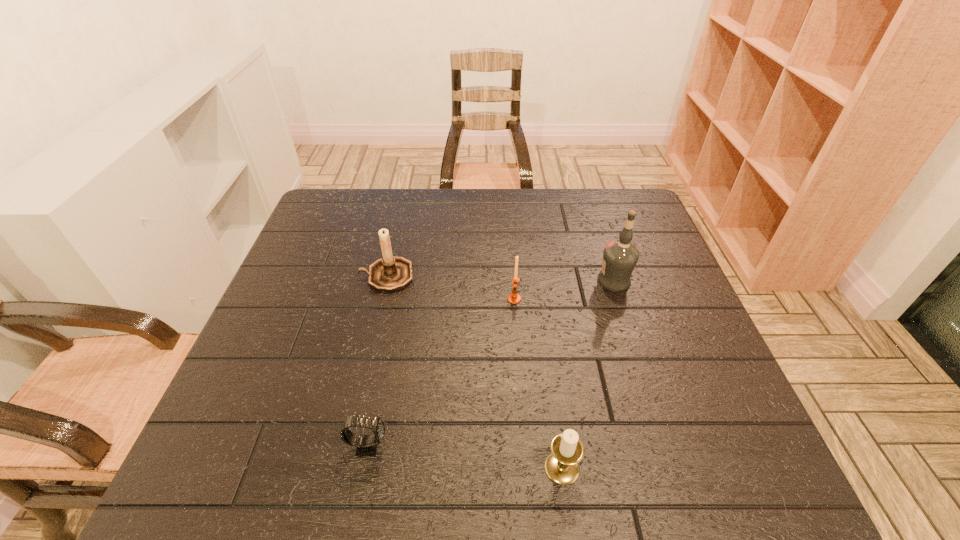
Find the location of a particular element. Image resolution: width=960 pixels, height=540 pixels. vacant space situated 0.270m on the front label of the rightmost object is located at coordinates (494, 281).

At what (x,y) coordinates should I click in order to perform the action: click on vacant space situated 0.060m on the back of the leftmost candle holder. Please return your answer as a coordinate pair (x, y). The width and height of the screenshot is (960, 540). Looking at the image, I should click on (394, 246).

The width and height of the screenshot is (960, 540). Identify the location of vacant space located 0.380m on the right of the second nearest candle holder. (672, 299).

I want to click on free space located 0.320m on the back of the second object from right to left, so click(x=542, y=321).

I want to click on vacant space located on the face of the watch, so click(489, 446).

The image size is (960, 540). What are the coordinates of `candle holder positioned at the near edge` in the screenshot? It's located at (562, 465).

The height and width of the screenshot is (540, 960). I want to click on watch that is at the near edge, so click(366, 446).

Where is `object present at the right edge`? The image size is (960, 540). object present at the right edge is located at coordinates (620, 257).

Where is `vacant region at the far edge of the desktop`? This screenshot has height=540, width=960. vacant region at the far edge of the desktop is located at coordinates (383, 193).

In the image, there is a desktop. Where is `vacant area at the near edge`? The image size is (960, 540). vacant area at the near edge is located at coordinates (518, 451).